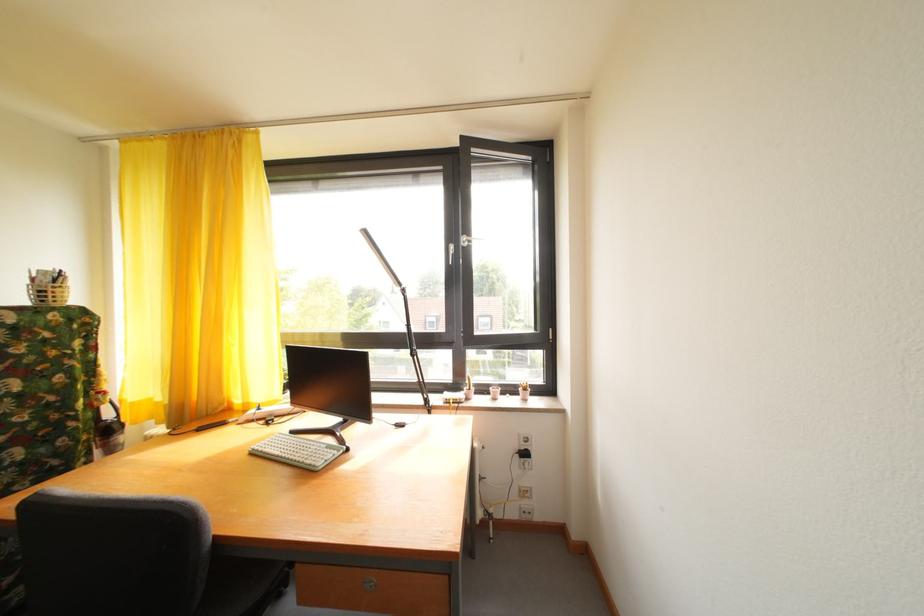
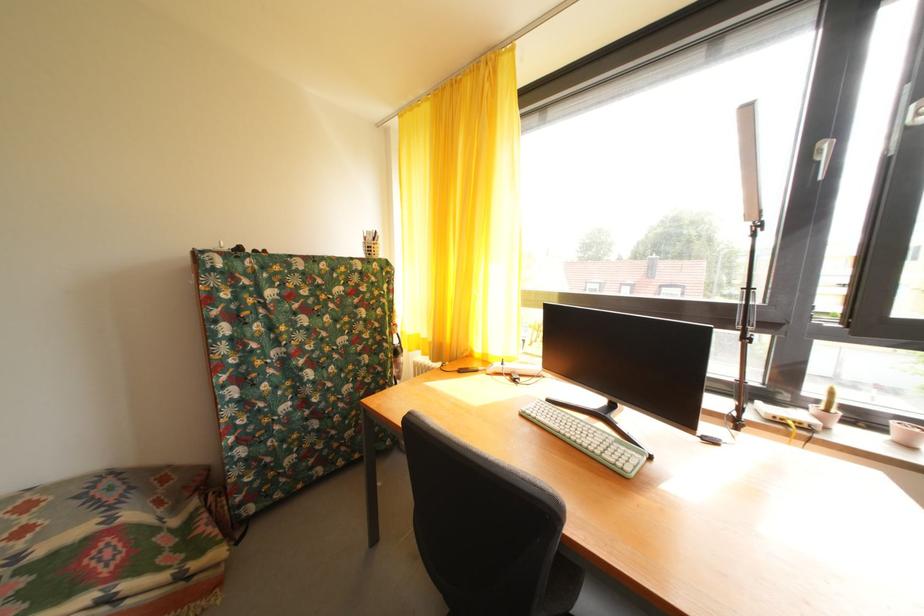
Where in the second image is the point corresponding to the point at 455,399 from the first image?

(768, 408)